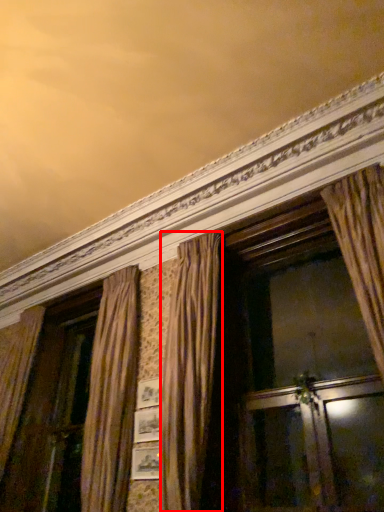
Question: From the image, what is the correct spatial relationship of curtain (annotated by the red box) in relation to screen door?

Choices:
 (A) left
 (B) right

Answer: (A)